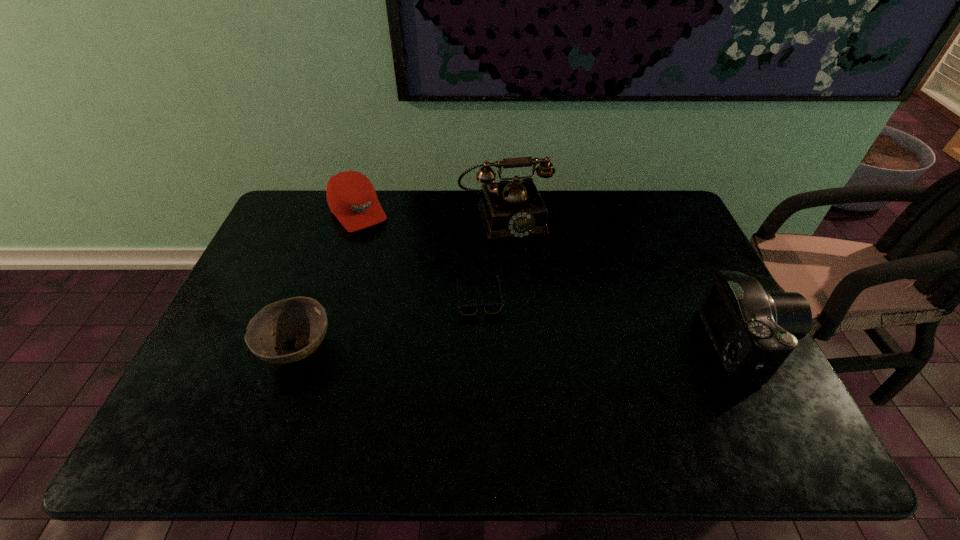
Where is `free region at the far left corner of the desktop`? This screenshot has height=540, width=960. free region at the far left corner of the desktop is located at coordinates [317, 212].

In the image, there is a desktop. Identify the location of vacant space at the far right corner. (650, 205).

Locate an element on the screen. The height and width of the screenshot is (540, 960). vacant space at the near right corner of the desktop is located at coordinates (712, 388).

Where is `empty location between the fourth shortest object and the telephone`? The width and height of the screenshot is (960, 540). empty location between the fourth shortest object and the telephone is located at coordinates (627, 281).

At what (x,y) coordinates should I click in order to perform the action: click on empty space that is in between the bowl and the telephone. Please return your answer as a coordinate pair (x, y). The height and width of the screenshot is (540, 960). Looking at the image, I should click on (400, 282).

At what (x,y) coordinates should I click in order to perform the action: click on vacant space in between the camera and the sunglasses. Please return your answer as a coordinate pair (x, y). Looking at the image, I should click on (614, 321).

Identify the location of blank region between the bowl and the telephone. Image resolution: width=960 pixels, height=540 pixels. (400, 282).

The image size is (960, 540). I want to click on vacant point located between the bowl and the third shortest object, so click(x=327, y=280).

I want to click on free point between the tallest object and the sunglasses, so click(492, 256).

What are the coordinates of `vacant area that lies between the cap and the second shortest object` in the screenshot? It's located at (327, 280).